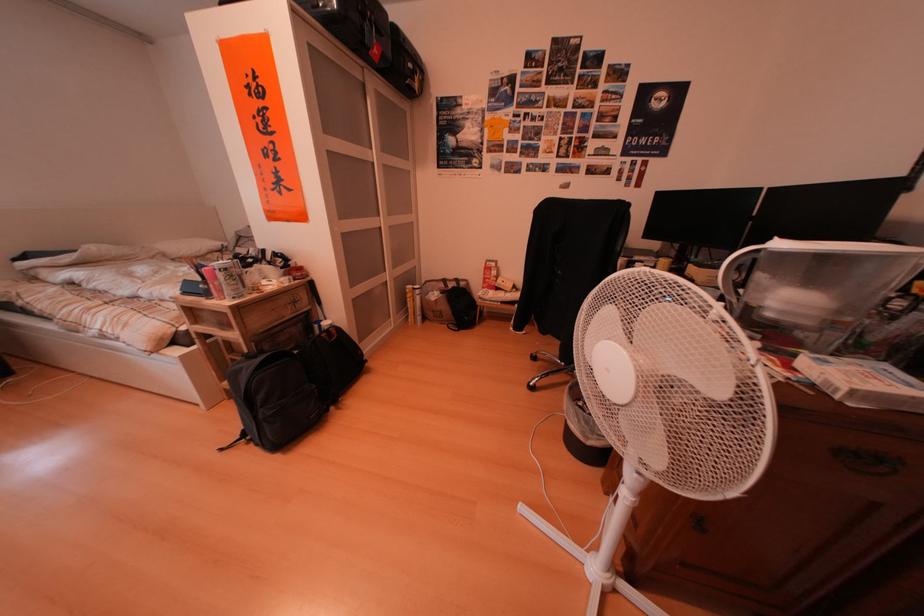
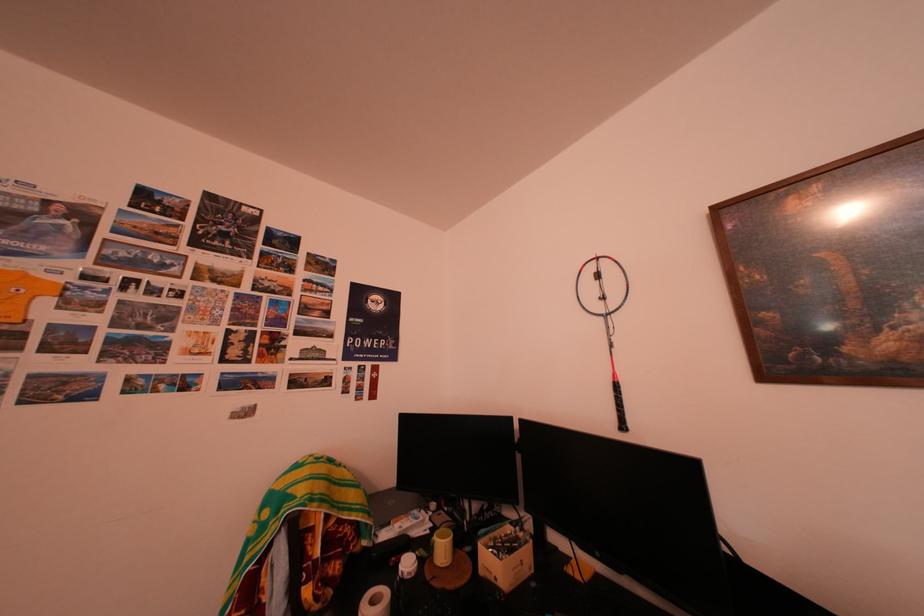
Question: I am providing you with two images of the same scene from different viewpoints. After the viewpoint changes to image2, which objects are now occluded?

Choices:
 (A) small cardboard box
 (B) badminton racket handle
 (C) yellow mug
 (D) none of these

Answer: (D)